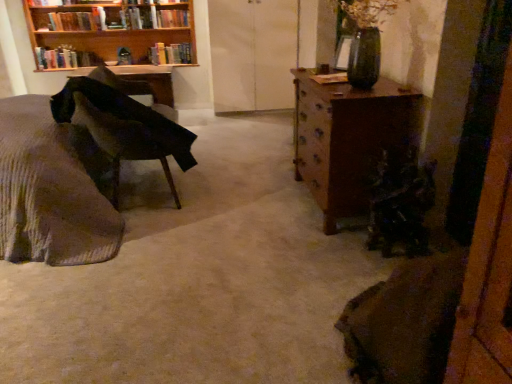
Question: Is hardcover book at upper left, the 2th book positioned from the right, looking in the opposite direction of woolen fabric bed at left?

Choices:
 (A) yes
 (B) no

Answer: (B)

Question: Does hardcover book at upper left, which appears as the 2th book when viewed from the left, come behind woolen fabric bed at left?

Choices:
 (A) yes
 (B) no

Answer: (A)

Question: Does hardcover book at upper left, the 2th book positioned from the right, touch woolen fabric bed at left?

Choices:
 (A) no
 (B) yes

Answer: (A)

Question: Is hardcover book at upper left, the 2th book positioned from the right, located outside woolen fabric bed at left?

Choices:
 (A) no
 (B) yes

Answer: (B)

Question: From the image's perspective, is hardcover book at upper left, which appears as the 2th book when viewed from the left, on woolen fabric bed at left?

Choices:
 (A) no
 (B) yes

Answer: (B)

Question: Is point (75, 77) positioned closer to the camera than point (48, 221)?

Choices:
 (A) farther
 (B) closer

Answer: (A)

Question: Considering the relative positions of velvet dark green chair at left and woolen fabric bed at left in the image provided, is velvet dark green chair at left to the left or to the right of woolen fabric bed at left?

Choices:
 (A) left
 (B) right

Answer: (B)

Question: In terms of size, does velvet dark green chair at left appear bigger or smaller than woolen fabric bed at left?

Choices:
 (A) small
 (B) big

Answer: (A)

Question: Is velvet dark green chair at left inside or outside of woolen fabric bed at left?

Choices:
 (A) outside
 (B) inside

Answer: (B)

Question: Considering their positions, is hardcover books at upper left, acting as the 3th book starting from the right, located in front of or behind velvet dark green chair at left?

Choices:
 (A) behind
 (B) front

Answer: (A)

Question: From a real-world perspective, is hardcover books at upper left, arranged as the first book when viewed from the left, positioned above or below velvet dark green chair at left?

Choices:
 (A) below
 (B) above

Answer: (B)

Question: Looking at the image, does hardcover books at upper left, arranged as the first book when viewed from the left, seem bigger or smaller compared to velvet dark green chair at left?

Choices:
 (A) big
 (B) small

Answer: (B)

Question: Based on their positions, is hardcover books at upper left, acting as the 3th book starting from the right, located to the left or right of velvet dark green chair at left?

Choices:
 (A) right
 (B) left

Answer: (B)

Question: Considering their positions, is hardcover books at upper left, arranged as the first book when viewed from the left, located in front of or behind woolen fabric bed at left?

Choices:
 (A) front
 (B) behind

Answer: (B)

Question: Choose the correct answer: Is hardcover books at upper left, acting as the 3th book starting from the right, inside woolen fabric bed at left or outside it?

Choices:
 (A) outside
 (B) inside

Answer: (A)